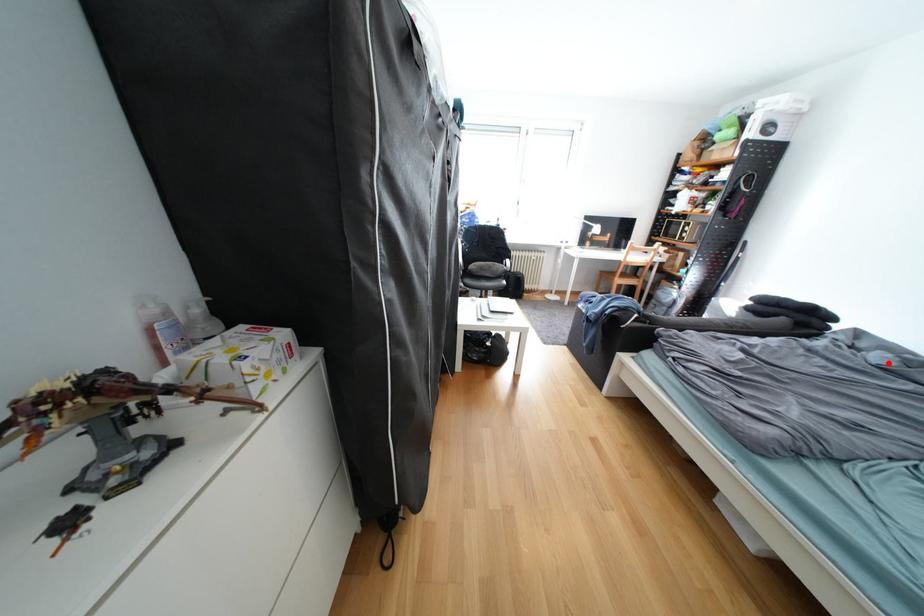
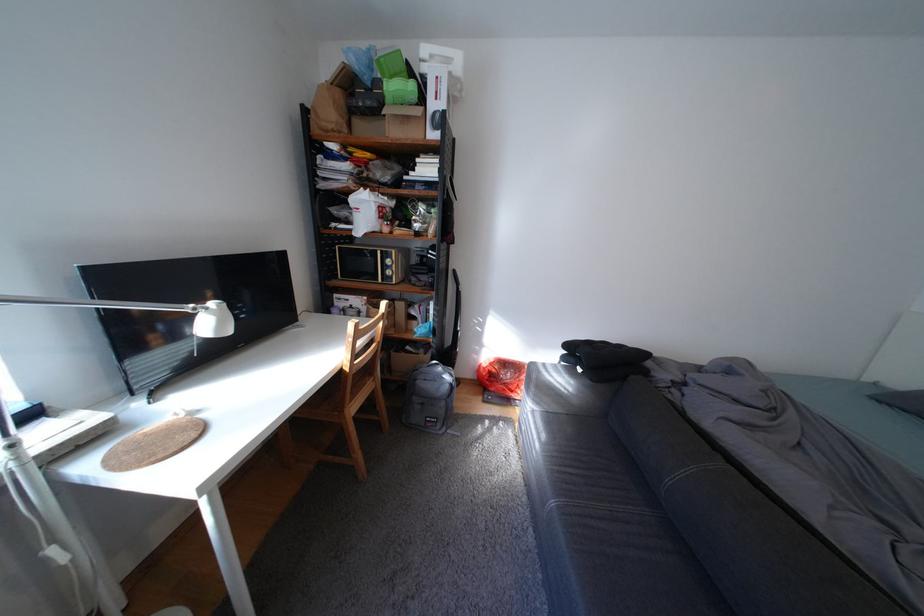
The point at the highlighted location is marked in the first image. Where is the corresponding point in the second image?

(773, 407)